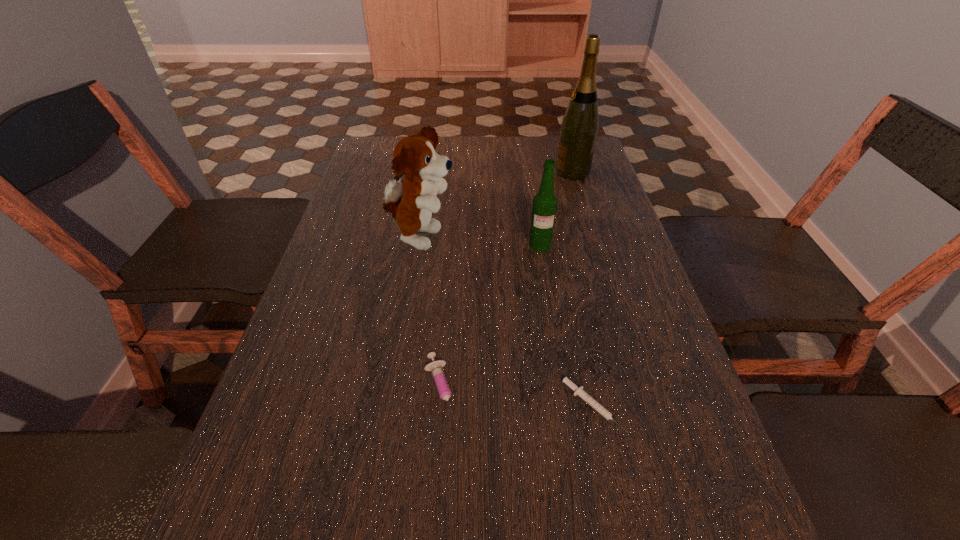
Locate an element on the screen. vacant point located between the tallest object and the shorter syringe is located at coordinates (583, 289).

This screenshot has width=960, height=540. In order to click on free space that is in between the shorter syringe and the tallest object in this screenshot , I will do `click(583, 289)`.

Image resolution: width=960 pixels, height=540 pixels. I want to click on object that is the fourth closest one to the third tallest object, so click(579, 391).

Identify the location of object that is the second closest to the puppy. The width and height of the screenshot is (960, 540). (441, 383).

Find the location of a particular element. syringe object that ranks as the closest to the fourth shortest object is located at coordinates pyautogui.click(x=441, y=383).

This screenshot has height=540, width=960. Find the location of `vacant space that satisfies the following two spatial constraints: 1. on the front-facing side of the tallest object; 2. on the front side of the shorter syringe`. vacant space that satisfies the following two spatial constraints: 1. on the front-facing side of the tallest object; 2. on the front side of the shorter syringe is located at coordinates (643, 406).

Find the location of a particular element. free region that satisfies the following two spatial constraints: 1. on the label of the third shortest object; 2. on the right side of the right syringe is located at coordinates (565, 406).

Identify the location of free location that satisfies the following two spatial constraints: 1. on the face of the right syringe; 2. on the right side of the fourth shortest object. (394, 406).

The width and height of the screenshot is (960, 540). I want to click on free space that satisfies the following two spatial constraints: 1. on the face of the fourth shortest object; 2. on the left side of the shorter syringe, so click(394, 406).